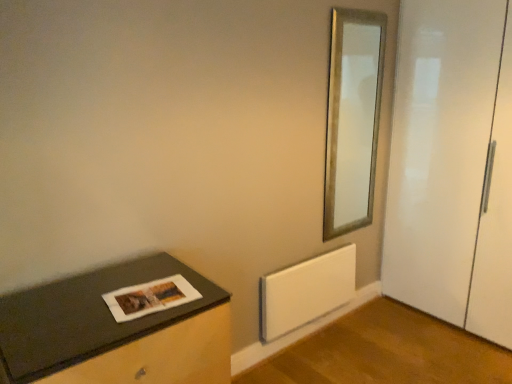
Locate an element on the screen. The image size is (512, 384). vacant area on top of matte paper magazine at lower left (from a real-world perspective) is located at coordinates (147, 291).